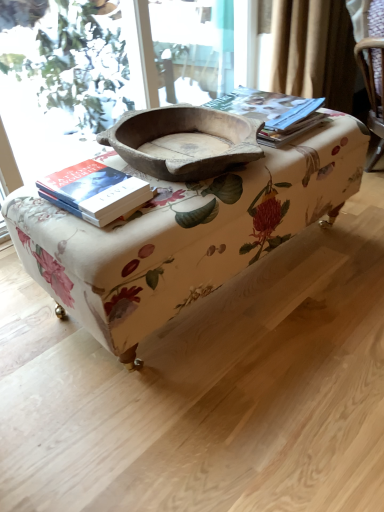
Question: Is hardcover book at left bigger or smaller than natural wood bowl at center?

Choices:
 (A) small
 (B) big

Answer: (A)

Question: Based on their positions, is hardcover book at left located to the left or right of natural wood bowl at center?

Choices:
 (A) left
 (B) right

Answer: (A)

Question: Which is nearer to the natural wood bowl at center?

Choices:
 (A) matte paper at upper right
 (B) floral fabric ottoman at center
 (C) hardcover book at left

Answer: (C)

Question: Which of these objects is positioned farthest from the matte paper at upper right?

Choices:
 (A) hardcover book at left
 (B) natural wood bowl at center
 (C) floral fabric ottoman at center

Answer: (A)